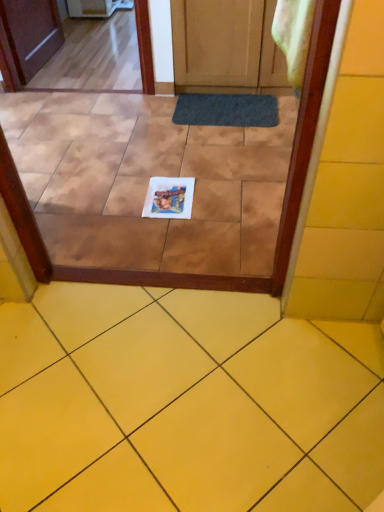
Find the location of `vacant space to the right of white glossy coaster at center`. vacant space to the right of white glossy coaster at center is located at coordinates [221, 196].